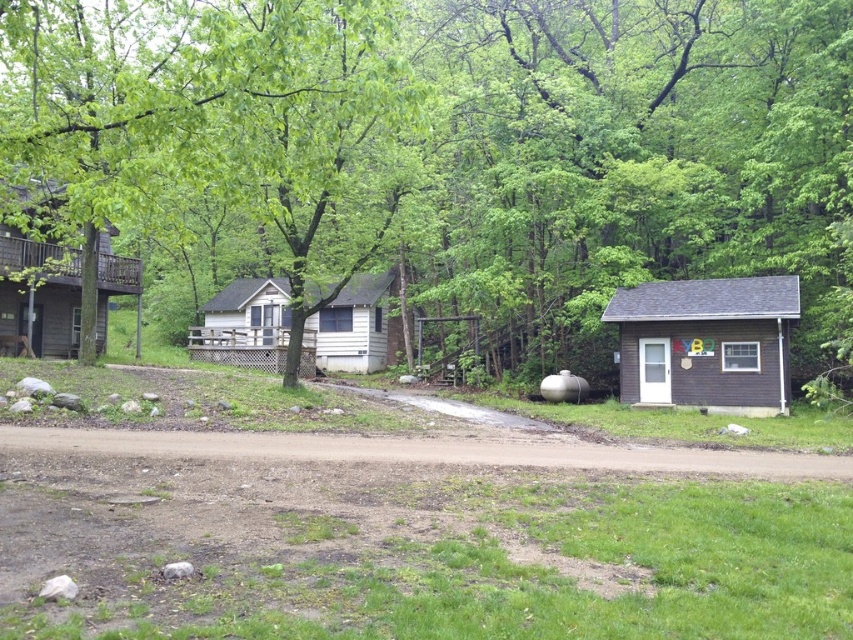
Question: Which object is positioned closest to the wooden cabin at left?

Choices:
 (A) light beige wood cabin at center
 (B) green leafy tree at center
 (C) brown wood cabin at right

Answer: (A)

Question: Can you confirm if green leafy tree at center is bigger than wooden cabin at left?

Choices:
 (A) no
 (B) yes

Answer: (B)

Question: Which of the following is the farthest from the observer?

Choices:
 (A) (740, 380)
 (B) (582, 70)
 (C) (380, 352)
 (D) (4, 273)

Answer: (C)

Question: Is brown wood cabin at right further to camera compared to wooden cabin at left?

Choices:
 (A) no
 (B) yes

Answer: (B)

Question: From the image, what is the correct spatial relationship of brown wood cabin at right in relation to light beige wood cabin at center?

Choices:
 (A) above
 (B) below

Answer: (B)

Question: Which object is farther from the camera taking this photo?

Choices:
 (A) light beige wood cabin at center
 (B) brown wood cabin at right
 (C) green leafy tree at center

Answer: (B)